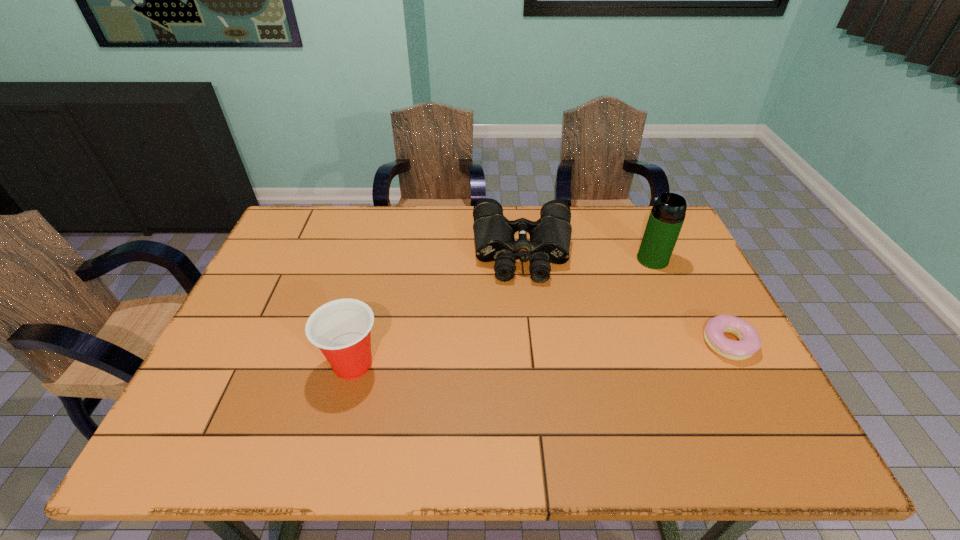
At what (x,y) coordinates should I click in order to perform the action: click on free spot on the desktop that is between the leftmost object and the shortest object and is positioned through the eyepieces of the second shortest object. Please return your answer as a coordinate pair (x, y). Image resolution: width=960 pixels, height=540 pixels. Looking at the image, I should click on (529, 355).

Locate an element on the screen. This screenshot has height=540, width=960. free space on the desktop that is between the cup and the shortest object and is positioned from the spout of the tallest object is located at coordinates (499, 356).